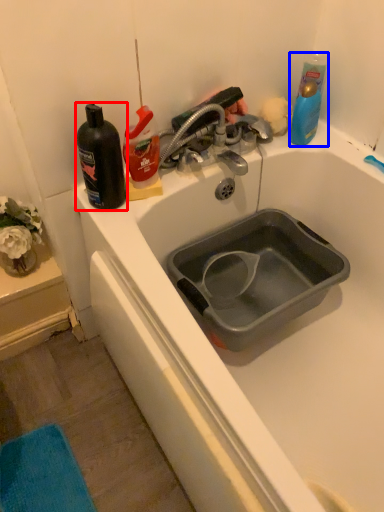
Question: Which object appears closest to the camera in this image, mouthwash (highlighted by a red box) or cleaning product (highlighted by a blue box)?

Choices:
 (A) mouthwash
 (B) cleaning product

Answer: (A)